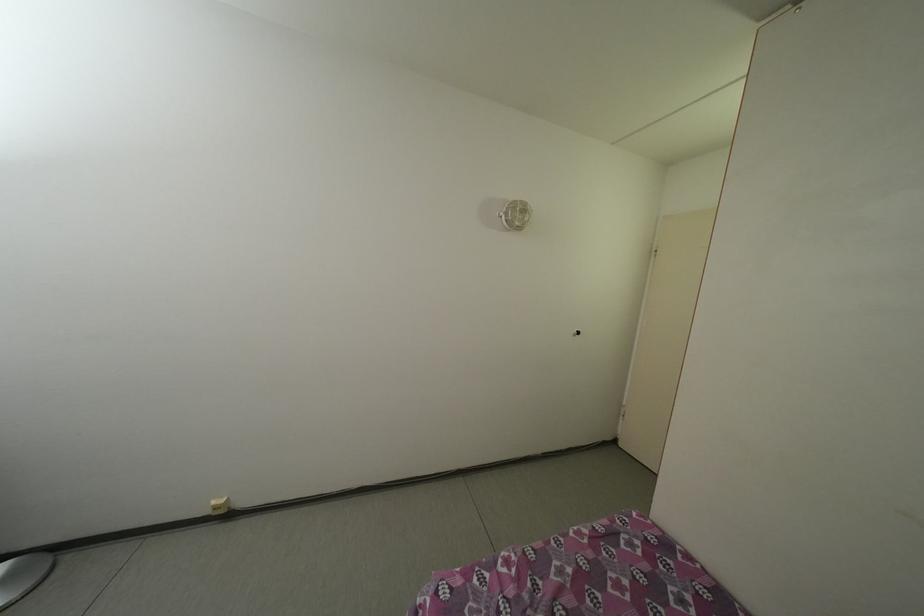
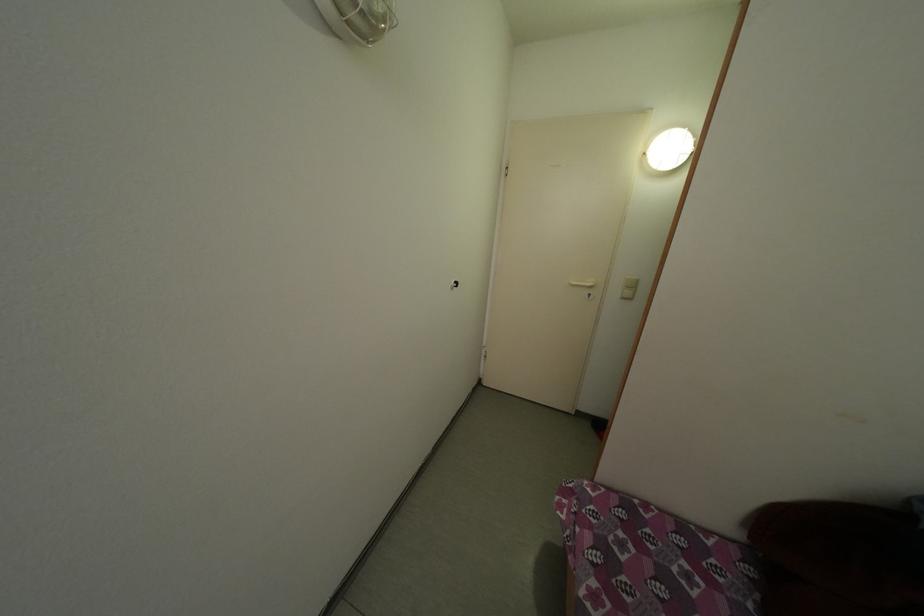
How did the camera likely rotate?

The camera rotated toward right-down.